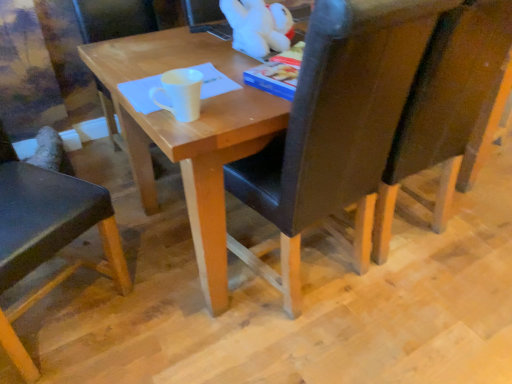
At what (x,y) coordinates should I click in order to perform the action: click on free location in front of black leather chair at center, which is counted as the second chair, starting from the right. Please return your answer as a coordinate pair (x, y). This screenshot has height=384, width=512. Looking at the image, I should click on (322, 354).